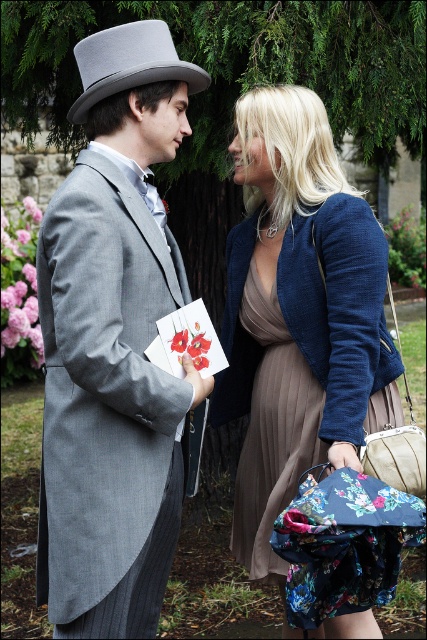
Question: Is gray wool top hat at upper left positioned behind gray felt top hat at upper left?

Choices:
 (A) yes
 (B) no

Answer: (B)

Question: Considering the relative positions of gray wool top hat at upper left and gray felt top hat at upper left in the image provided, where is gray wool top hat at upper left located with respect to gray felt top hat at upper left?

Choices:
 (A) left
 (B) right

Answer: (A)

Question: Which object appears farthest from the camera in this image?

Choices:
 (A) matte blue blazer at center
 (B) gray wool top hat at upper left
 (C) gray felt top hat at upper left

Answer: (A)

Question: Can you confirm if gray wool top hat at upper left is positioned below matte blue blazer at center?

Choices:
 (A) no
 (B) yes

Answer: (A)

Question: Which point is closer to the camera?

Choices:
 (A) gray wool top hat at upper left
 (B) gray felt top hat at upper left

Answer: (A)

Question: Which of these objects is positioned closest to the matte blue blazer at center?

Choices:
 (A) gray wool top hat at upper left
 (B) gray felt top hat at upper left

Answer: (A)